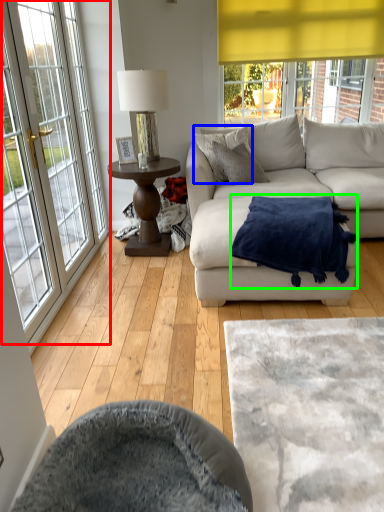
Question: Which object is the farthest from window (highlighted by a red box)? Choose among these: pillow (highlighted by a blue box) or blanket (highlighted by a green box).

Choices:
 (A) pillow
 (B) blanket

Answer: (B)